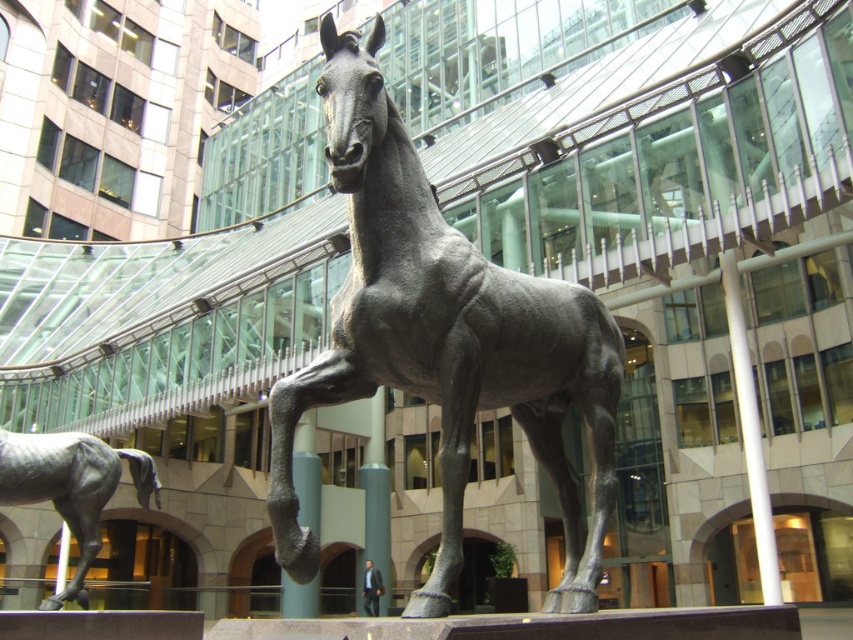
Is polished bronze horse at lower left above polished white pole at center?

Actually, polished bronze horse at lower left is below polished white pole at center.

Who is more forward, (35, 496) or (730, 326)?

Positioned in front is point (35, 496).

Image resolution: width=853 pixels, height=640 pixels. I want to click on polished bronze horse at lower left, so click(x=71, y=486).

I want to click on polished bronze horse at lower left, so click(71, 486).

Is point (358, 145) more distant than point (764, 492)?

No, it is in front of (764, 492).

Does bronze horse at center lie in front of polished white pole at center?

Yes, bronze horse at center is closer to the viewer.

Which is in front, point (537, 328) or point (762, 541)?

Point (537, 328) is in front.

Locate an element on the screen. bronze horse at center is located at coordinates (444, 339).

Does bronze horse at center have a lesser width compared to polished bronze horse at lower left?

Indeed, bronze horse at center has a lesser width compared to polished bronze horse at lower left.

Measure the distance between bronze horse at center and polished bronze horse at lower left.

bronze horse at center is 13.24 meters away from polished bronze horse at lower left.

The image size is (853, 640). What do you see at coordinates (444, 339) in the screenshot?
I see `bronze horse at center` at bounding box center [444, 339].

Image resolution: width=853 pixels, height=640 pixels. I want to click on bronze horse at center, so click(x=444, y=339).